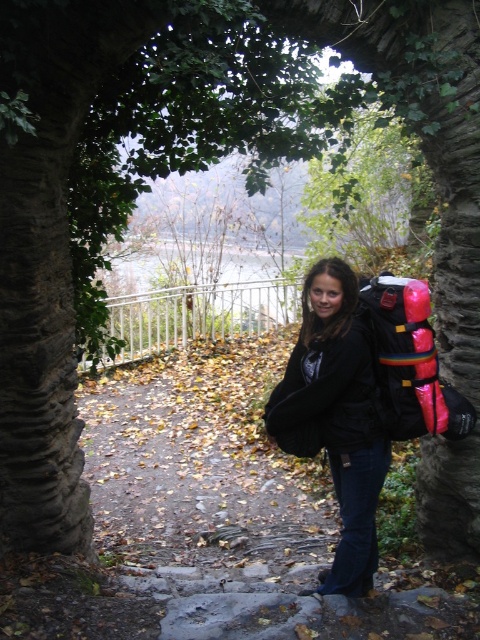
Is point (312, 403) positioned behind point (389, 314)?

No.

Who is positioned more to the right, black matte jacket at center or rubberized pink backpack at right?

rubberized pink backpack at right is more to the right.

Does point (324, 285) lie behind point (418, 310)?

Yes, point (324, 285) is behind point (418, 310).

Locate an element on the screen. The image size is (480, 640). black matte jacket at center is located at coordinates (336, 416).